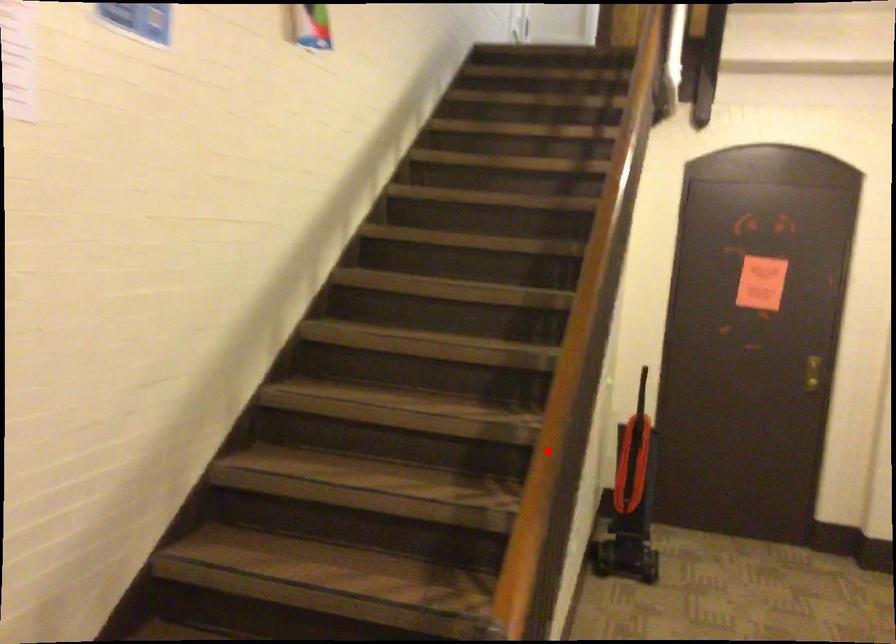
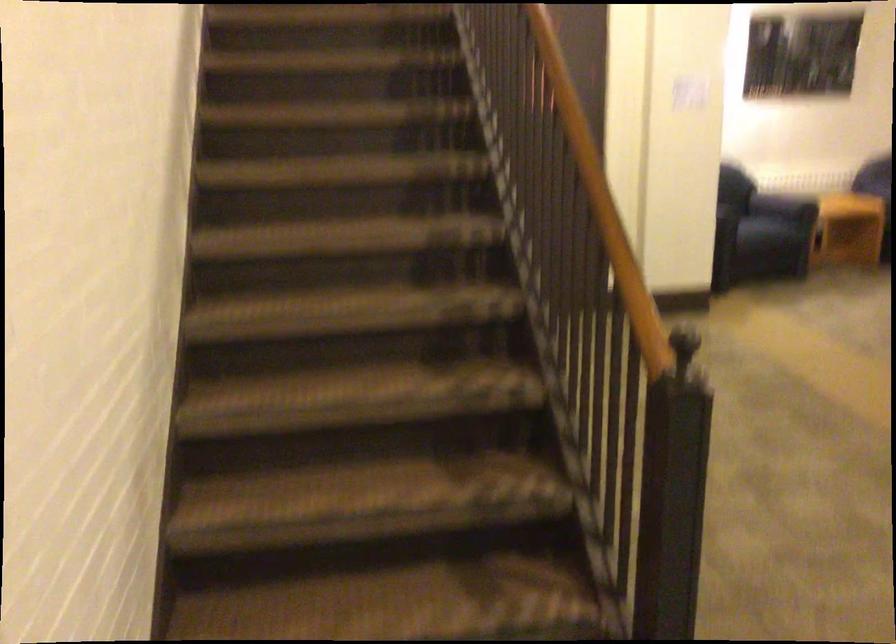
Question: I am providing you with two images of the same scene from different viewpoints. Given a red point in image1, look at the same physical point in image2. Is it:

Choices:
 (A) Closer to the viewpoint
 (B) Farther from the viewpoint

Answer: (B)